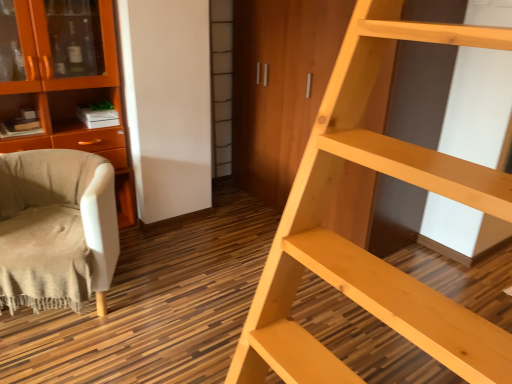
This screenshot has width=512, height=384. I want to click on vacant area that is situated to the right of beige fabric chair at left, so click(x=157, y=298).